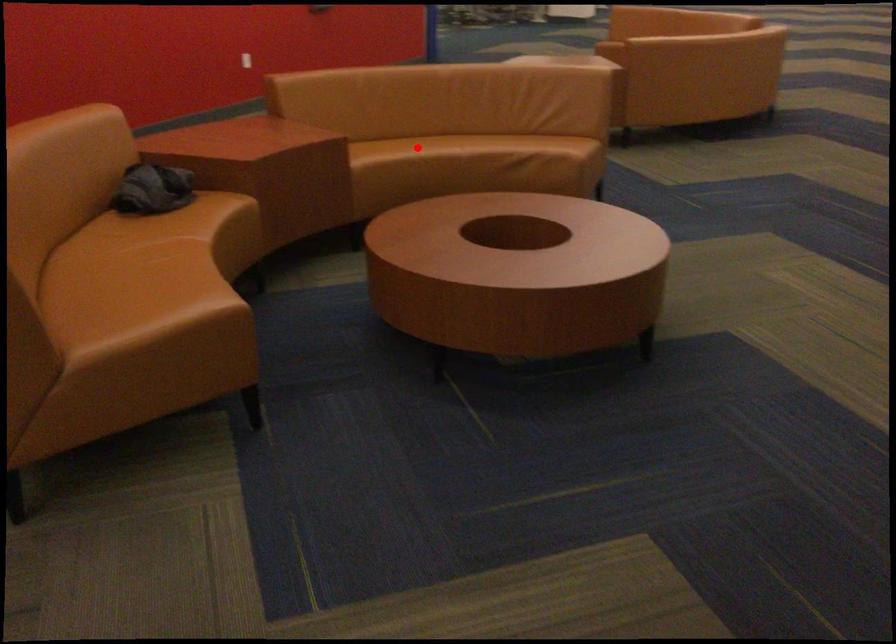
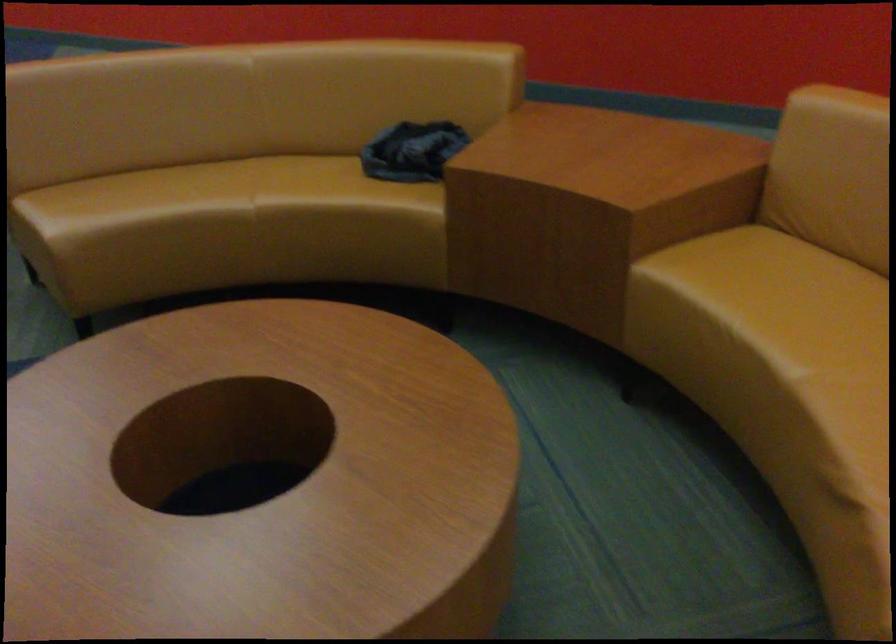
Where in the second image is the point corresponding to the highlighted location from the first image?

(814, 308)